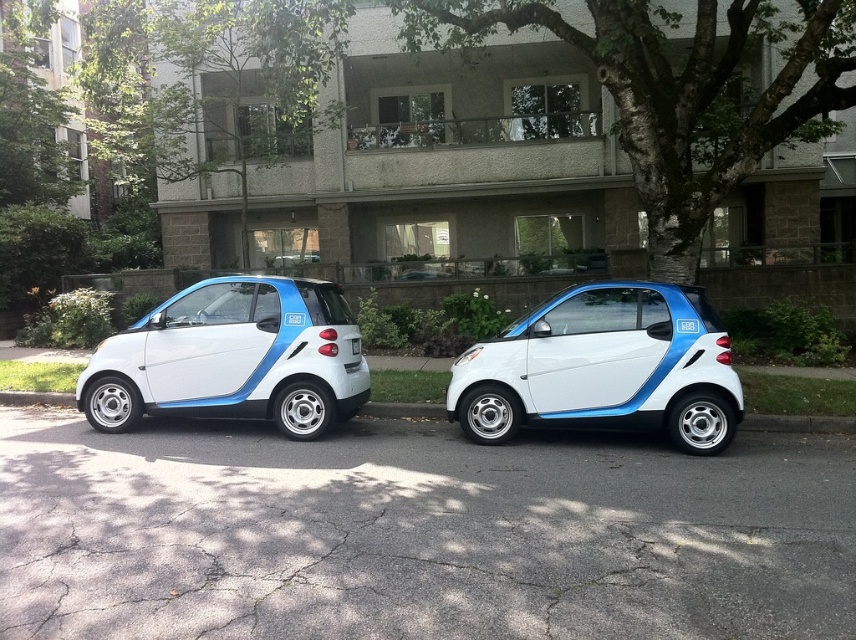
You are standing at the camera position and want to reach the point at coordinates (477,401). The two cars are in your way. Can you walk around them to reach the point?

The point at (477,401) is 7.64 meters away from the camera, so you can walk around the two cars to reach it since the distance is sufficient.

You are standing on the sidewalk in front of the residential building and see both the white matte smart car at center and the white matte smart car at left. Which car is positioned closer to you?

The white matte smart car at center is closer to you than the white matte smart car at left.